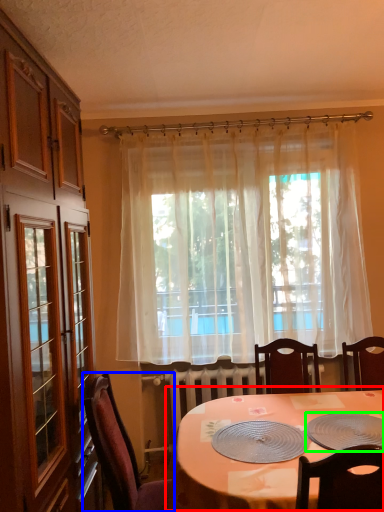
Question: Which object is the closest to the table (highlighted by a red box)? Choose among these: chair (highlighted by a blue box) or platter (highlighted by a green box).

Choices:
 (A) chair
 (B) platter

Answer: (B)